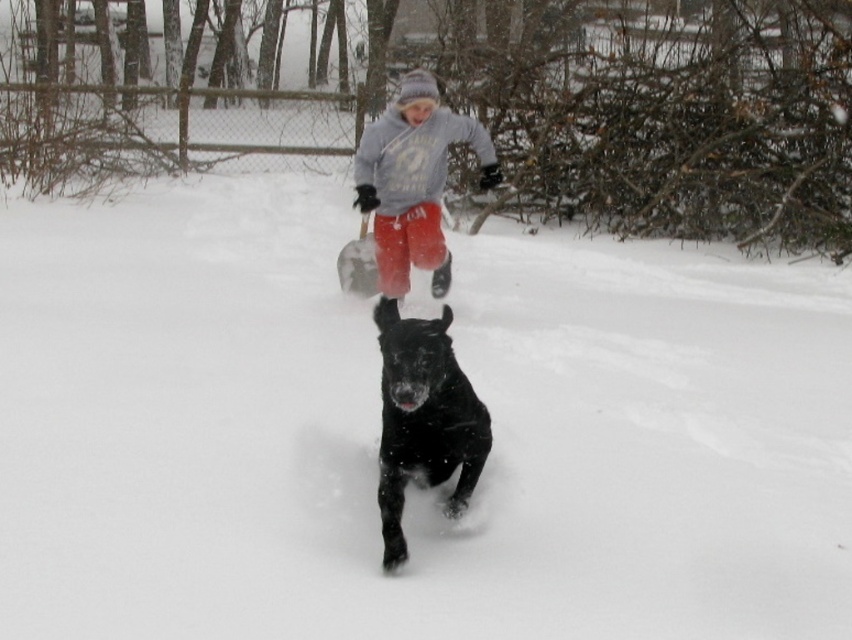
Does point (258, 230) come closer to viewer compared to point (387, 449)?

No, (258, 230) is further to viewer.

Does point (10, 474) come behind point (439, 388)?

Yes.

Describe the element at coordinates (378, 429) in the screenshot. I see `white fluffy snow at center` at that location.

Where is `white fluffy snow at center`? The width and height of the screenshot is (852, 640). white fluffy snow at center is located at coordinates (378, 429).

Which is behind, point (406, 368) or point (396, 182)?

The point (396, 182) is behind.

Between point (427, 444) and point (361, 173), which one is positioned in front?

Positioned in front is point (427, 444).

Is point (456, 385) closer to camera compared to point (401, 259)?

That is True.

What are the coordinates of `black glossy dog at center` in the screenshot? It's located at (423, 419).

Which is more to the left, white fluffy snow at center or gray fleece sweatshirt at center?

white fluffy snow at center is more to the left.

Who is higher up, white fluffy snow at center or gray fleece sweatshirt at center?

gray fleece sweatshirt at center

Does point (780, 321) come in front of point (440, 113)?

No.

Where is `white fluffy snow at center`? The width and height of the screenshot is (852, 640). white fluffy snow at center is located at coordinates (378, 429).